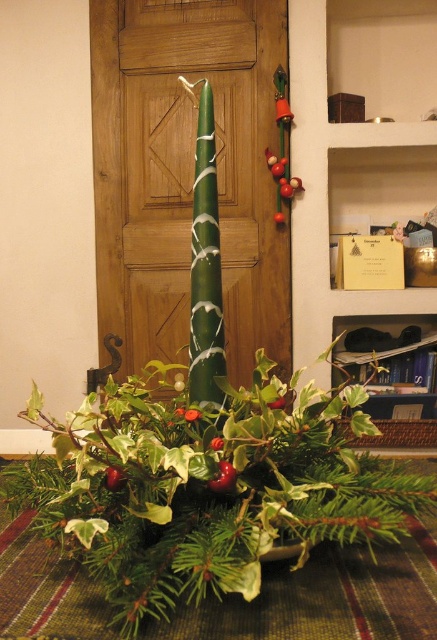
Question: Does matte brown wood bookshelf at upper center come in front of metallic green ornament at upper center?

Choices:
 (A) yes
 (B) no

Answer: (B)

Question: Does matte brown wood bookshelf at upper center appear on the right side of metallic green ornament at upper center?

Choices:
 (A) yes
 (B) no

Answer: (A)

Question: Does green matte candle at center have a larger size compared to metallic green ornament at upper center?

Choices:
 (A) yes
 (B) no

Answer: (A)

Question: Among these points, which one is farthest from the camera?

Choices:
 (A) pyautogui.click(x=58, y=484)
 (B) pyautogui.click(x=319, y=3)

Answer: (B)

Question: Which of these objects is positioned closest to the green matte candle at center?

Choices:
 (A) matte brown wood bookshelf at upper center
 (B) metallic green ornament at upper center

Answer: (B)

Question: Estimate the real-world distances between objects in this image. Which object is farther from the metallic green ornament at upper center?

Choices:
 (A) matte brown wood bookshelf at upper center
 (B) green matte candle at center

Answer: (B)